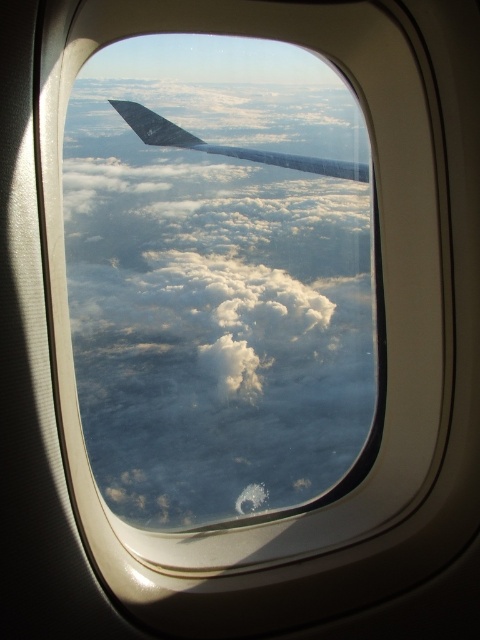
Question: Which of the following is the farthest from the observer?

Choices:
 (A) metallic gray wing at upper center
 (B) white fluffy cloud at center

Answer: (A)

Question: Can you confirm if white fluffy cloud at center is positioned below metallic gray wing at upper center?

Choices:
 (A) no
 (B) yes

Answer: (B)

Question: In this image, where is white fluffy cloud at center located relative to metallic gray wing at upper center?

Choices:
 (A) below
 (B) above

Answer: (A)

Question: Among these points, which one is farthest from the camera?

Choices:
 (A) (272, 476)
 (B) (197, 141)

Answer: (B)

Question: Is white fluffy cloud at center wider than metallic gray wing at upper center?

Choices:
 (A) yes
 (B) no

Answer: (A)